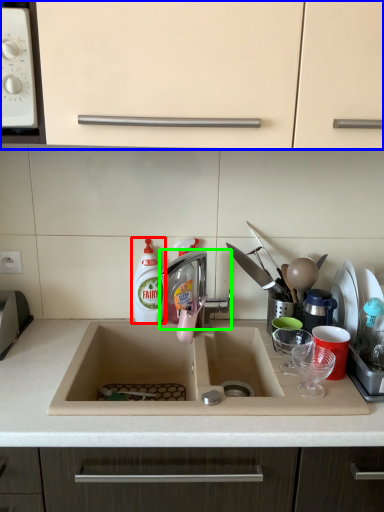
Question: Based on their relative distances, which object is nearer to cleaning product (highlighted by a red box)? Choose from cabinetry (highlighted by a blue box) and tap (highlighted by a green box).

Choices:
 (A) cabinetry
 (B) tap

Answer: (B)